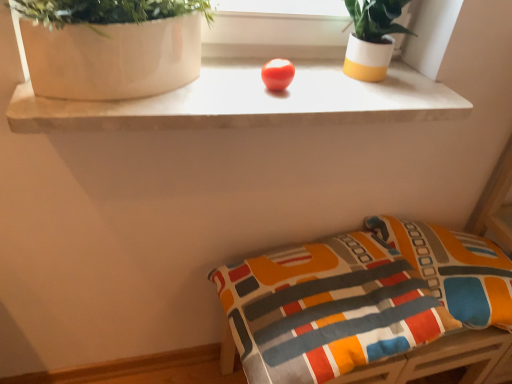
Find the location of a particular element. vacant area that is situated to the right of white glossy vase at upper left is located at coordinates (262, 80).